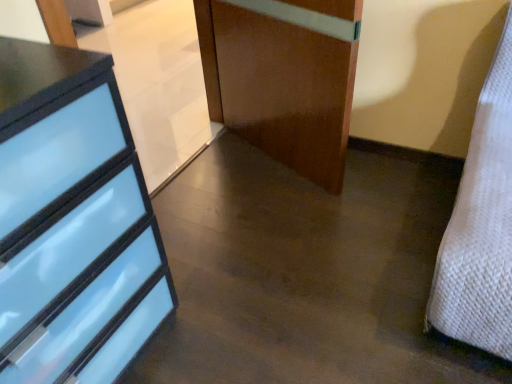
Locate an element on the screen. The height and width of the screenshot is (384, 512). vacant region to the left of brown matte door at center is located at coordinates (222, 176).